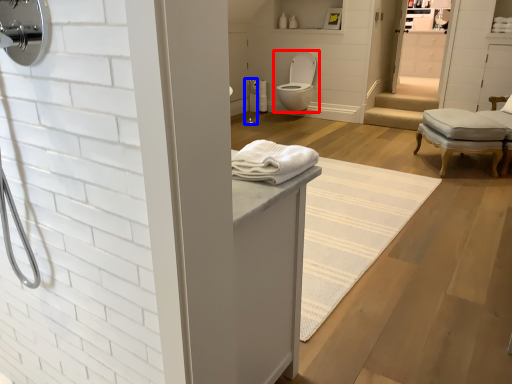
Question: Which object is closer to the camera taking this photo, toilet (highlighted by a red box) or shower (highlighted by a blue box)?

Choices:
 (A) toilet
 (B) shower

Answer: (A)